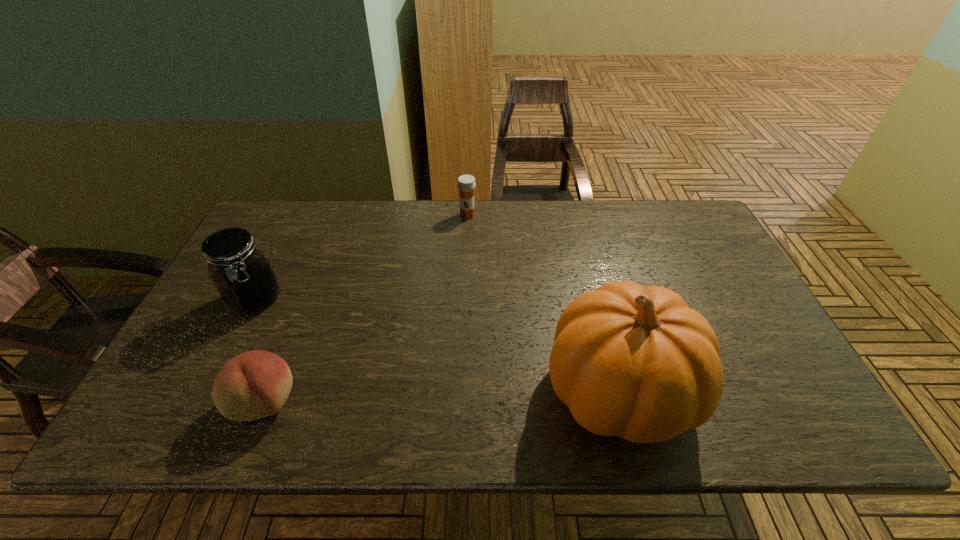
You are a GUI agent. You are given a task and a screenshot of the screen. Output one action in this format:
    pyautogui.click(x=<x>, y=<y>)
    Task: Click on the free region located 0.200m on the label side of the medicine
    
    Given the screenshot: What is the action you would take?
    pyautogui.click(x=451, y=260)

This screenshot has width=960, height=540. In order to click on vacant region located 0.080m on the label side of the medicine in this screenshot , I will do `click(460, 235)`.

The image size is (960, 540). Find the location of `vacant space situated on the lid of the third shortest object`. vacant space situated on the lid of the third shortest object is located at coordinates (332, 344).

What are the coordinates of `blank space located 0.180m on the lid of the third shortest object` in the screenshot? It's located at (323, 339).

Find the location of `vacant point located 0.060m on the lid of the third shortest object`. vacant point located 0.060m on the lid of the third shortest object is located at coordinates (290, 320).

At what (x,y) coordinates should I click in order to perform the action: click on object situated at the far edge. Please return your answer as a coordinate pair (x, y). The height and width of the screenshot is (540, 960). Looking at the image, I should click on [x=466, y=183].

At what (x,y) coordinates should I click in order to perform the action: click on peach present at the near edge. Please return your answer as a coordinate pair (x, y). The image size is (960, 540). Looking at the image, I should click on (255, 384).

Identify the location of pumpkin present at the near edge. (636, 362).

Find the location of a particular element. The image size is (960, 540). object located at the left edge is located at coordinates (244, 278).

In the image, there is a desktop. At what (x,y) coordinates should I click in order to perform the action: click on vacant area at the far edge. Please return your answer as a coordinate pair (x, y). Looking at the image, I should click on (533, 238).